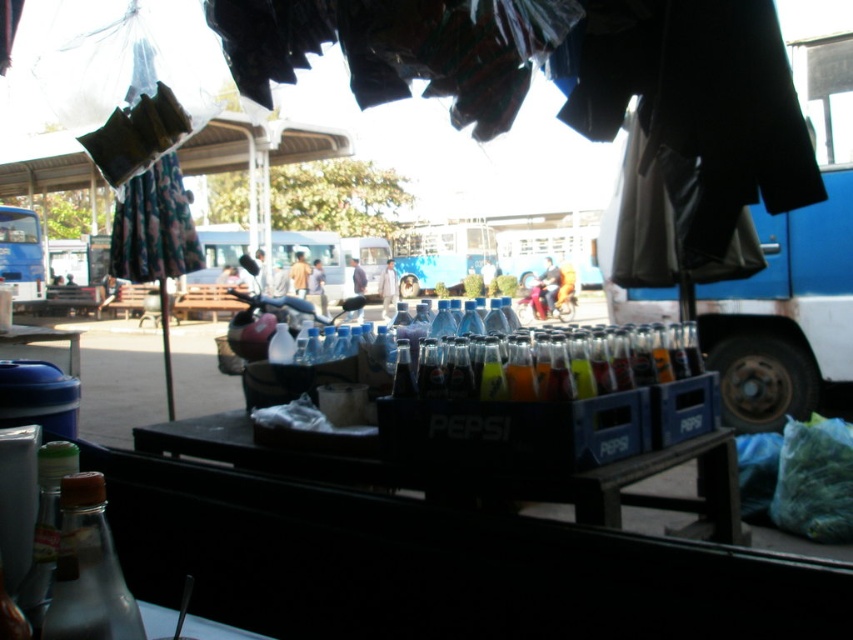
You are a customer at this market and want to pick up the translucent glass bottle at lower left and the matte plastic bottle at center. Which one should you reach for first to grab both efficiently?

You should reach for the translucent glass bottle at lower left first since it is closer to you than the matte plastic bottle at center, allowing you to efficiently grab both items.

Looking at this image, you are a delivery person who needs to carry both the transparent glass bottle at lower left and the blue matte bus at left. Which one should you pick up first if you want to carry the smaller item first?

The transparent glass bottle at lower left is smaller than the blue matte bus at left, so you should pick up the transparent glass bottle at lower left first.

You are a customer at the market and want to buy the transparent glass bottle at lower left. However, you notice the blue matte bus at left is blocking your path. Can you reach the bottle without moving the bus?

The transparent glass bottle at lower left is in front of the blue matte bus at left, so you can reach it without moving the bus since it is already positioned in front of the bus.